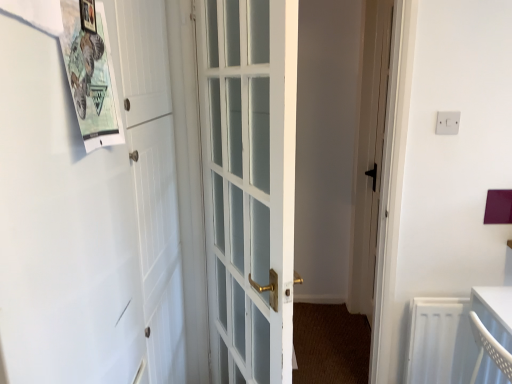
Question: Is white plastic electric outlet at upper right oriented towards white matte barn door at left?

Choices:
 (A) yes
 (B) no

Answer: (B)

Question: Would you say white matte barn door at left is part of white plastic electric outlet at upper right's contents?

Choices:
 (A) yes
 (B) no

Answer: (B)

Question: Is white plastic electric outlet at upper right positioned in front of white matte barn door at left?

Choices:
 (A) no
 (B) yes

Answer: (A)

Question: From a real-world perspective, does white plastic electric outlet at upper right stand above white matte barn door at left?

Choices:
 (A) no
 (B) yes

Answer: (B)

Question: From the image's perspective, is white plastic electric outlet at upper right under white matte barn door at left?

Choices:
 (A) yes
 (B) no

Answer: (B)

Question: Considering the relative sizes of white plastic electric outlet at upper right and white matte barn door at left in the image provided, is white plastic electric outlet at upper right taller than white matte barn door at left?

Choices:
 (A) yes
 (B) no

Answer: (B)

Question: Is paperboard poster at upper left aimed at wooden picture frame at upper left?

Choices:
 (A) yes
 (B) no

Answer: (A)

Question: Does paperboard poster at upper left appear on the right side of wooden picture frame at upper left?

Choices:
 (A) yes
 (B) no

Answer: (A)

Question: From a real-world perspective, is paperboard poster at upper left located higher than wooden picture frame at upper left?

Choices:
 (A) no
 (B) yes

Answer: (A)

Question: Is wooden picture frame at upper left inside paperboard poster at upper left?

Choices:
 (A) yes
 (B) no

Answer: (A)

Question: Is paperboard poster at upper left positioned far away from wooden picture frame at upper left?

Choices:
 (A) yes
 (B) no

Answer: (B)

Question: Considering the relative positions of paperboard poster at upper left and wooden picture frame at upper left in the image provided, is paperboard poster at upper left to the left of wooden picture frame at upper left from the viewer's perspective?

Choices:
 (A) no
 (B) yes

Answer: (A)

Question: Considering the relative positions of paperboard poster at upper left and white plastic electric outlet at upper right in the image provided, is paperboard poster at upper left behind white plastic electric outlet at upper right?

Choices:
 (A) no
 (B) yes

Answer: (A)